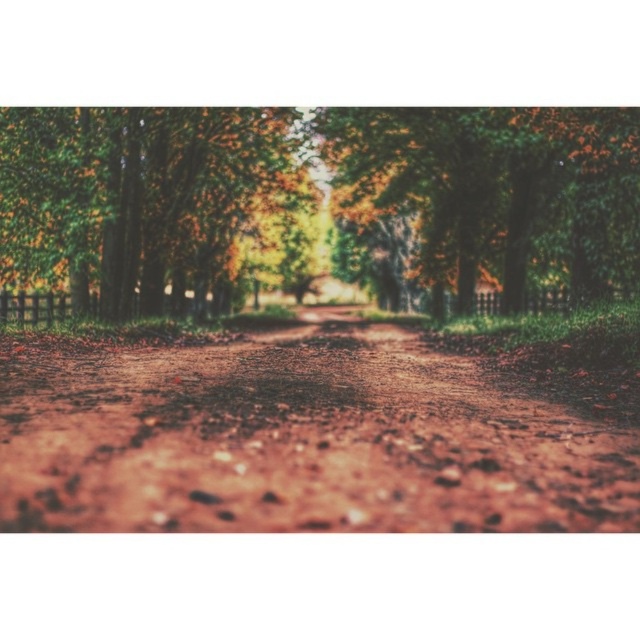
From the picture: You are standing at the start of the forest path and want to reach the point marked as point (x=198, y=468). If your walking speed is 1.5 meters per second, how many seconds will it take you to reach that point?

The point (x=198, y=468) is 4.72 meters away from the viewer. At a speed of 1.5 meters per second, it would take approximately 3.15 seconds to reach it.

You are standing on the dirt path and want to take a photo of both the green leafy forest at center and the green leafy tree at upper left. Which one should you zoom in on more to ensure both are clearly visible in the frame?

The green leafy forest at center is larger than the green leafy tree at upper left, so you should zoom in more on the green leafy tree at upper left to balance their sizes in the photo.